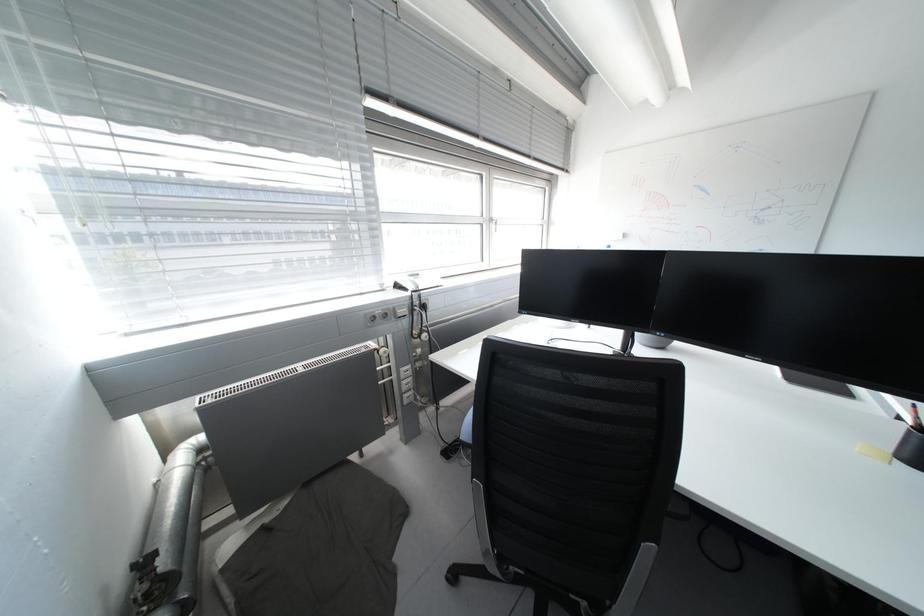
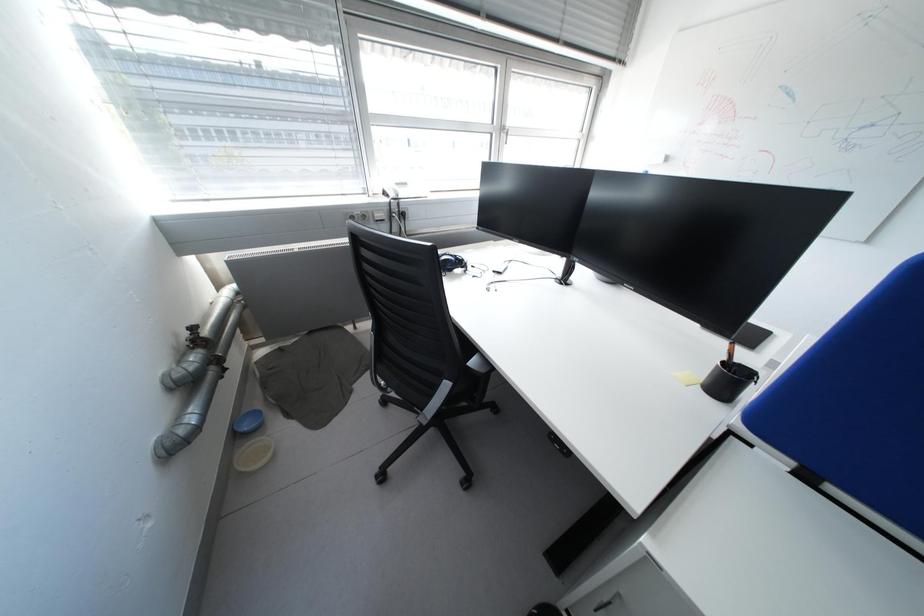
Question: The first image is from the beginning of the video and the second image is from the end. How did the camera likely rotate when shooting the video?

Choices:
 (A) Left
 (B) Right
 (C) Up
 (D) Down

Answer: (D)